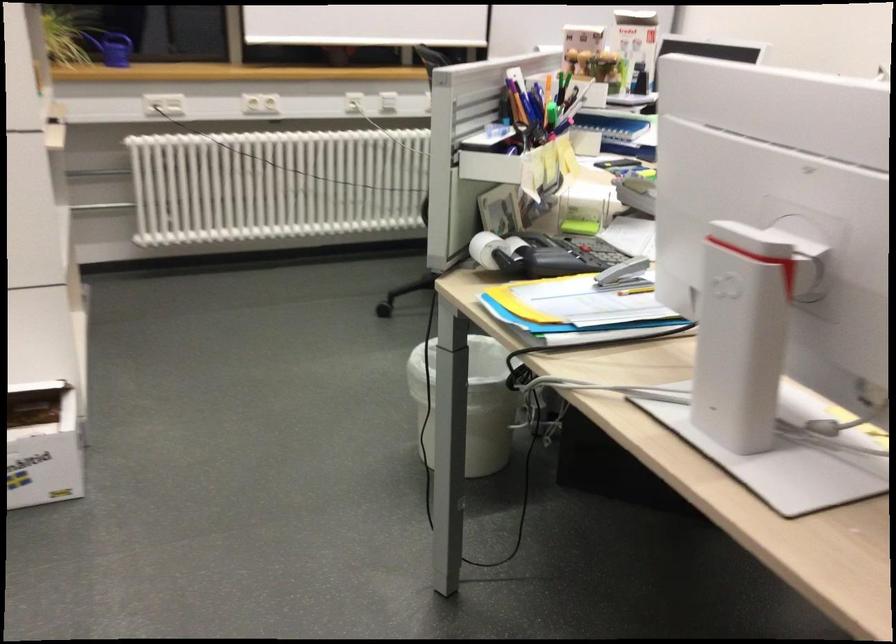
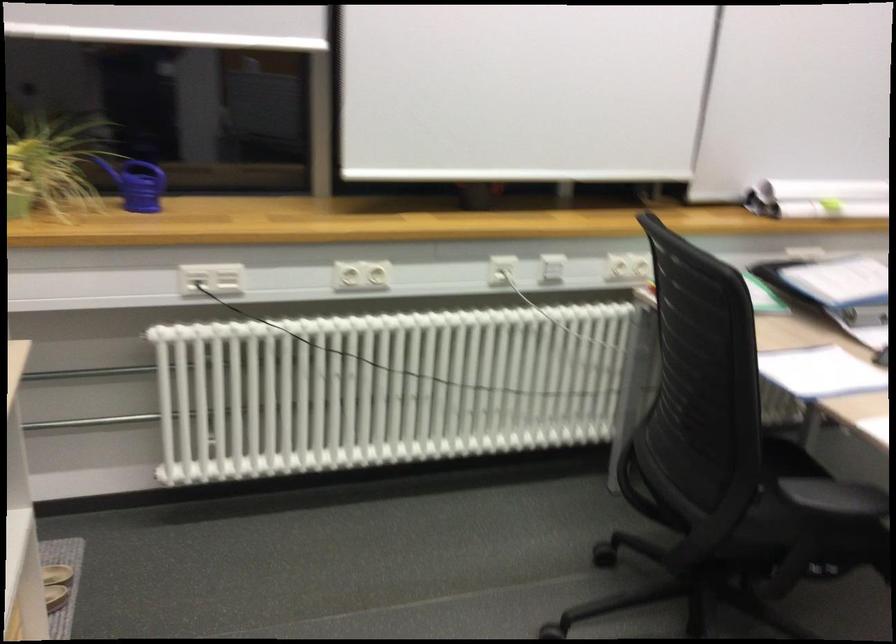
The images are taken continuously from a first-person perspective. In which direction are you moving?

The cameraman moved toward left, forward.